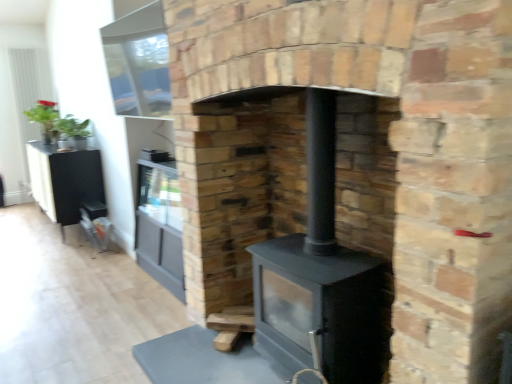
What is the approximate width of black matte wood burning stove at center?

Result: It is 16.35 inches.

Locate an element on the screen. The image size is (512, 384). black matte entertainment center at left is located at coordinates (65, 181).

Based on the photo, does black matte wood stove at center appear on the right side of black matte wood burning stove at center?

No.

Is black matte wood stove at center positioned with its back to black matte wood burning stove at center?

Yes, black matte wood stove at center's orientation is away from black matte wood burning stove at center.

Which of these two, black matte wood stove at center or black matte wood burning stove at center, is smaller?

With smaller size is black matte wood burning stove at center.

Is black matte wood stove at center turned away from black matte entertainment center at left?

That's not correct — black matte wood stove at center is not looking away from black matte entertainment center at left.

From a real-world perspective, between black matte wood stove at center and black matte entertainment center at left, who is vertically lower?

In real-world perspective, black matte entertainment center at left is lower.

From the image's perspective, does black matte wood stove at center appear lower than black matte entertainment center at left?

Correct, black matte wood stove at center appears lower than black matte entertainment center at left in the image.

Is black matte entertainment center at left to the left or to the right of black matte wood burning stove at center in the image?

Based on their positions, black matte entertainment center at left is located to the left of black matte wood burning stove at center.

Based on the photo, considering the relative sizes of black matte entertainment center at left and black matte wood burning stove at center in the image provided, is black matte entertainment center at left taller than black matte wood burning stove at center?

In fact, black matte entertainment center at left may be shorter than black matte wood burning stove at center.

Does black matte entertainment center at left have a greater width compared to black matte wood burning stove at center?

Indeed, black matte entertainment center at left has a greater width compared to black matte wood burning stove at center.

Is black matte entertainment center at left bigger than black matte wood burning stove at center?

Yes.

What's the angular difference between black matte wood burning stove at center and black matte wood stove at center's facing directions?

The angular difference between black matte wood burning stove at center and black matte wood stove at center is 0.000126 degrees.

Looking at this image, who is bigger, black matte wood burning stove at center or black matte wood stove at center?

Bigger between the two is black matte wood stove at center.

Between black matte wood burning stove at center and black matte wood stove at center, which one appears on the left side from the viewer's perspective?

From the viewer's perspective, black matte wood stove at center appears more on the left side.

Measure the distance between black matte wood burning stove at center and black matte entertainment center at left.

black matte wood burning stove at center and black matte entertainment center at left are 2.84 meters apart.

Is black matte wood burning stove at center turned away from black matte entertainment center at left?

No, black matte wood burning stove at center is not facing the opposite direction of black matte entertainment center at left.

Is black matte wood burning stove at center not close to black matte entertainment center at left?

Yes, black matte wood burning stove at center is far from black matte entertainment center at left.

Does black matte wood burning stove at center contain black matte entertainment center at left?

No, black matte wood burning stove at center does not contain black matte entertainment center at left.

Relative to black matte wood stove at center, is black matte entertainment center at left in front or behind?

Clearly, black matte entertainment center at left is behind black matte wood stove at center.

Which object is wider, black matte entertainment center at left or black matte wood stove at center?

Wider between the two is black matte wood stove at center.

Which is more to the left, black matte entertainment center at left or black matte wood stove at center?

From the viewer's perspective, black matte entertainment center at left appears more on the left side.

Is point (78, 178) positioned behind point (438, 169)?

Yes, point (78, 178) is behind point (438, 169).

At what (x,y) coordinates should I click in order to perform the action: click on wood burning stove that is on the right side of black matte wood stove at center. Please return your answer as a coordinate pair (x, y). The image size is (512, 384). Looking at the image, I should click on (321, 279).

I want to click on fireplace in front of the black matte entertainment center at left, so (357, 157).

Considering their positions, is black matte entertainment center at left positioned closer to black matte wood stove at center than black matte wood burning stove at center?

The object closer to black matte wood stove at center is black matte wood burning stove at center.

When comparing their distances from black matte wood stove at center, does black matte wood burning stove at center or black matte entertainment center at left seem closer?

black matte wood burning stove at center is positioned closer to the anchor black matte wood stove at center.

Looking at the image, which one is located further to black matte wood burning stove at center, black matte entertainment center at left or black matte wood stove at center?

Among the two, black matte entertainment center at left is located further to black matte wood burning stove at center.

Considering their positions, is black matte wood burning stove at center positioned further to black matte entertainment center at left than black matte wood stove at center?

black matte wood burning stove at center is positioned further to the anchor black matte entertainment center at left.

From the image, which object appears to be farther from black matte wood burning stove at center, black matte wood stove at center or black matte entertainment center at left?

black matte entertainment center at left.

Based on their spatial positions, is black matte wood stove at center or black matte wood burning stove at center further from black matte entertainment center at left?

black matte wood burning stove at center is further to black matte entertainment center at left.

The image size is (512, 384). I want to click on wood burning stove between black matte wood stove at center and black matte entertainment center at left in the front-back direction, so click(x=321, y=279).